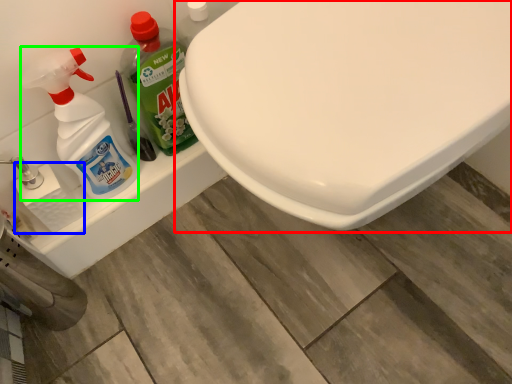
Question: Estimate the real-world distances between objects in this image. Which object is closer to toilet (highlighted by a red box), toilet paper (highlighted by a blue box) or cleaning product (highlighted by a green box)?

Choices:
 (A) toilet paper
 (B) cleaning product

Answer: (B)